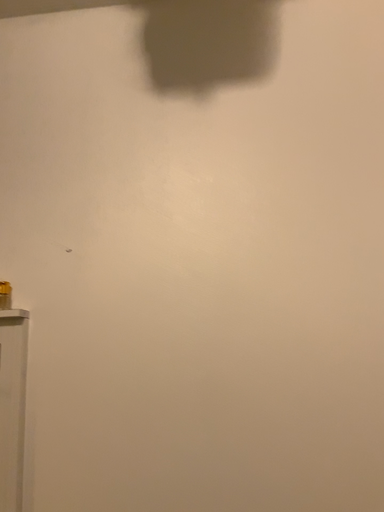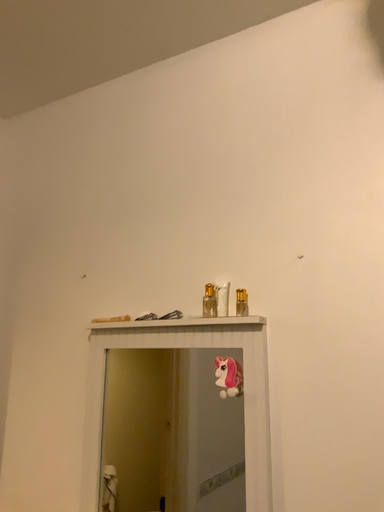
Question: How did the camera likely rotate when shooting the video?

Choices:
 (A) rotated right
 (B) rotated left

Answer: (B)